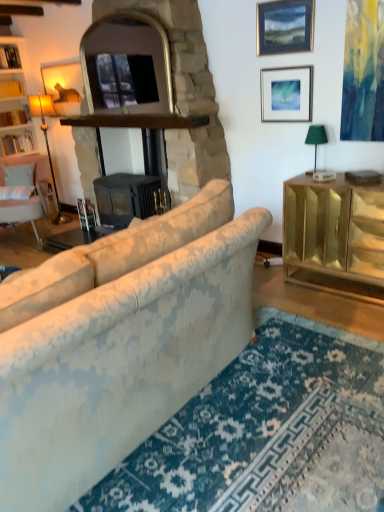
Question: Is gold mirrored cabinet at right positioned with its back to white wood bookshelf at left?

Choices:
 (A) no
 (B) yes

Answer: (A)

Question: Could you tell me if gold mirrored cabinet at right is turned towards white wood bookshelf at left?

Choices:
 (A) no
 (B) yes

Answer: (A)

Question: Is gold mirrored cabinet at right smaller than white wood bookshelf at left?

Choices:
 (A) yes
 (B) no

Answer: (B)

Question: From the image's perspective, does gold mirrored cabinet at right appear higher than white wood bookshelf at left?

Choices:
 (A) no
 (B) yes

Answer: (A)

Question: Is gold mirrored cabinet at right in contact with white wood bookshelf at left?

Choices:
 (A) yes
 (B) no

Answer: (B)

Question: Based on their sizes in the image, would you say floral fabric sofa at center is bigger or smaller than silver metallic picture frame at upper right, positioned as the 2th picture frame in top-to-bottom order?

Choices:
 (A) small
 (B) big

Answer: (B)

Question: In the image, is floral fabric sofa at center positioned in front of or behind silver metallic picture frame at upper right, acting as the 1th picture frame starting from the bottom?

Choices:
 (A) front
 (B) behind

Answer: (A)

Question: From a real-world perspective, is floral fabric sofa at center above or below silver metallic picture frame at upper right, acting as the 1th picture frame starting from the bottom?

Choices:
 (A) above
 (B) below

Answer: (B)

Question: Considering the positions of point (14, 501) and point (273, 120), is point (14, 501) closer or farther from the camera than point (273, 120)?

Choices:
 (A) farther
 (B) closer

Answer: (B)

Question: Is point tap(117, 119) closer or farther from the camera than point tap(344, 219)?

Choices:
 (A) farther
 (B) closer

Answer: (A)

Question: Is black matte fireplace at center, the second fireplace from the left, spatially inside gold mirrored cabinet at right, or outside of it?

Choices:
 (A) inside
 (B) outside

Answer: (B)

Question: In terms of width, does black matte fireplace at center, the second fireplace from the left, look wider or thinner when compared to gold mirrored cabinet at right?

Choices:
 (A) wide
 (B) thin

Answer: (A)

Question: From the image's perspective, relative to gold mirrored cabinet at right, is black matte fireplace at center, which appears as the first fireplace when viewed from the right, above or below?

Choices:
 (A) above
 (B) below

Answer: (A)

Question: In terms of height, does gold mirrored cabinet at right look taller or shorter compared to matte gold floor lamp at left, the first lamp from the left?

Choices:
 (A) short
 (B) tall

Answer: (A)

Question: Relative to matte gold floor lamp at left, the first lamp from the left, is gold mirrored cabinet at right in front or behind?

Choices:
 (A) behind
 (B) front

Answer: (B)